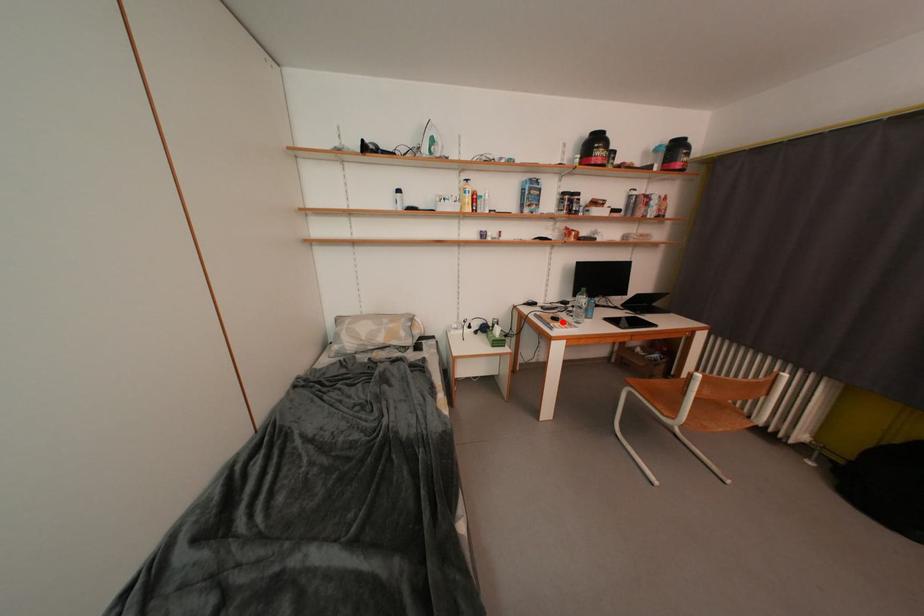
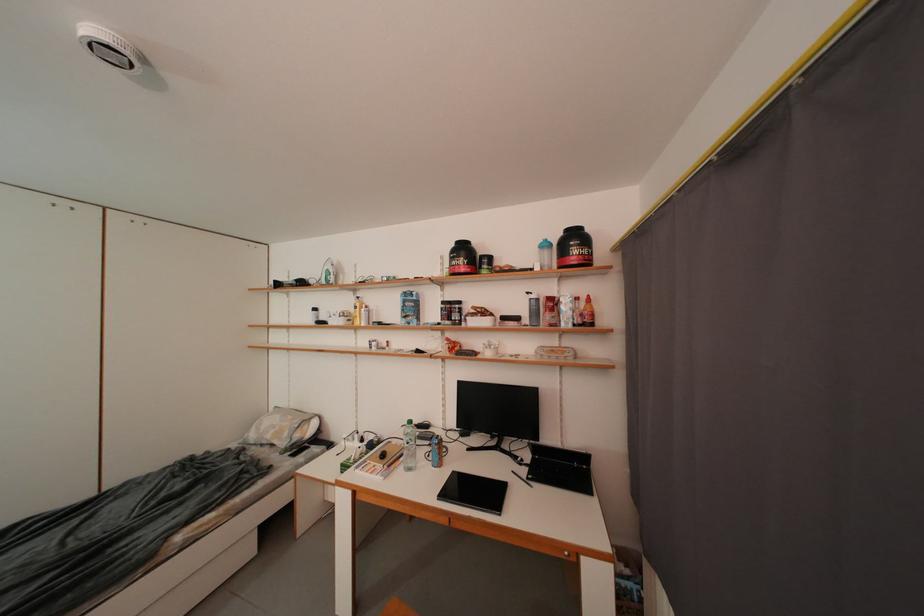
The point at the highlighted location is marked in the first image. Where is the corresponding point in the second image?

(391, 459)